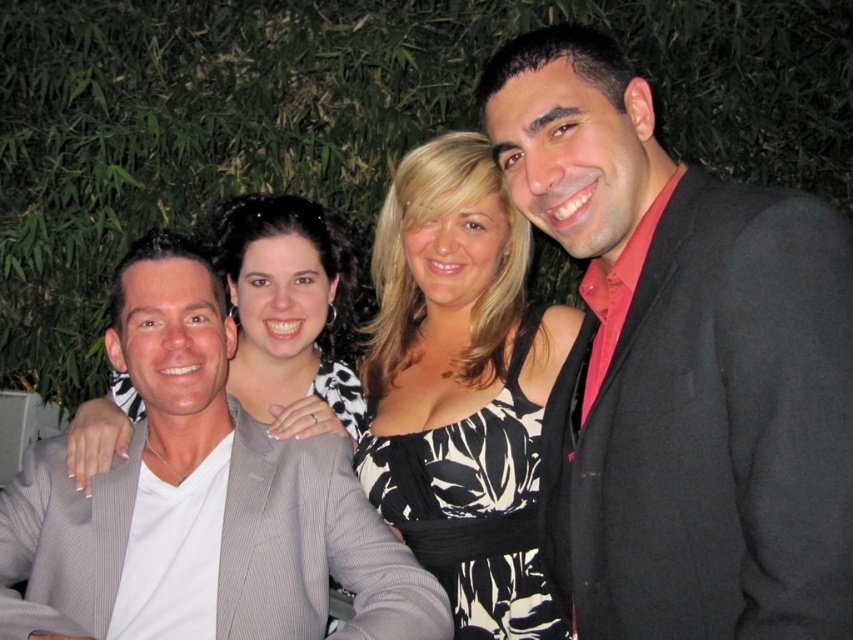
You are a photographer trying to decide which suit to recommend for a slimming effect. Based on the image, which of the two suits, the black matte suit at right or the gray pinstripe suit at left, would you suggest?

The black matte suit at right is thinner than the gray pinstripe suit at left, so it would be the better choice for a slimming effect.

You are a photographer who needs to adjust the lighting for a group photo. You have a spotlight that can only illuminate a specific area. If you want to focus the light on both the gray pinstripe suit at left and the black printed dress at center, which direction should you aim the spotlight considering their positions?

The gray pinstripe suit at left is positioned on the left side of the black printed dress at center. To illuminate both, aim the spotlight towards the center area where the black printed dress is located, as it is positioned further right than the gray pinstripe suit.